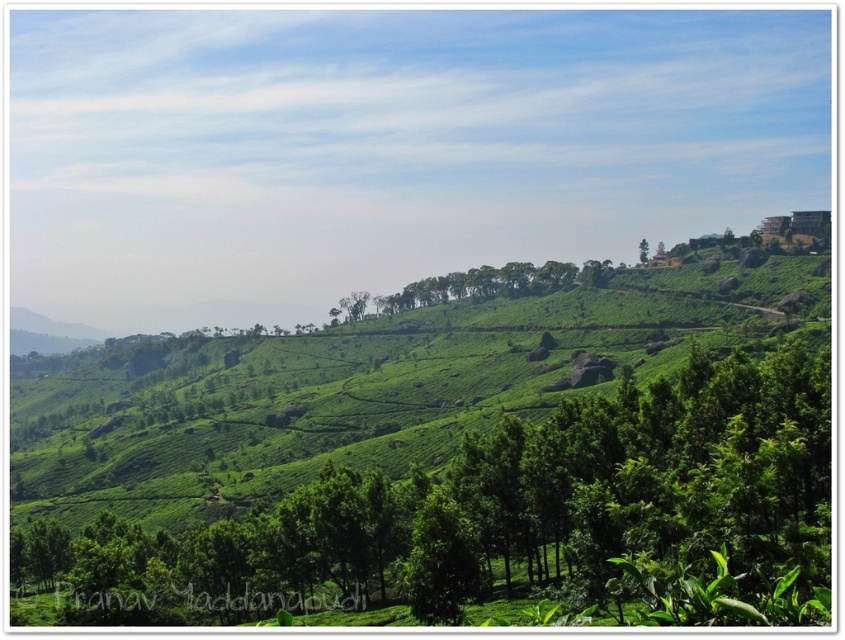
Looking at this image, does green leafy tree at center have a smaller size compared to green leafy tree at upper right?

Yes, green leafy tree at center is smaller than green leafy tree at upper right.

Is green leafy tree at center to the right of green leafy tree at upper right from the viewer's perspective?

In fact, green leafy tree at center is to the left of green leafy tree at upper right.

Image resolution: width=845 pixels, height=640 pixels. What are the coordinates of `green leafy tree at center` in the screenshot? It's located at (513, 516).

Locate an element on the screen. Image resolution: width=845 pixels, height=640 pixels. green leafy tree at center is located at coordinates (513, 516).